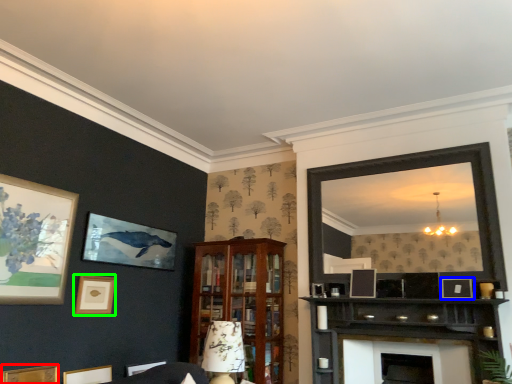
Question: Which is nearer to the picture frame (highlighted by a red box)? picture frame (highlighted by a blue box) or picture frame (highlighted by a green box).

Choices:
 (A) picture frame
 (B) picture frame

Answer: (B)